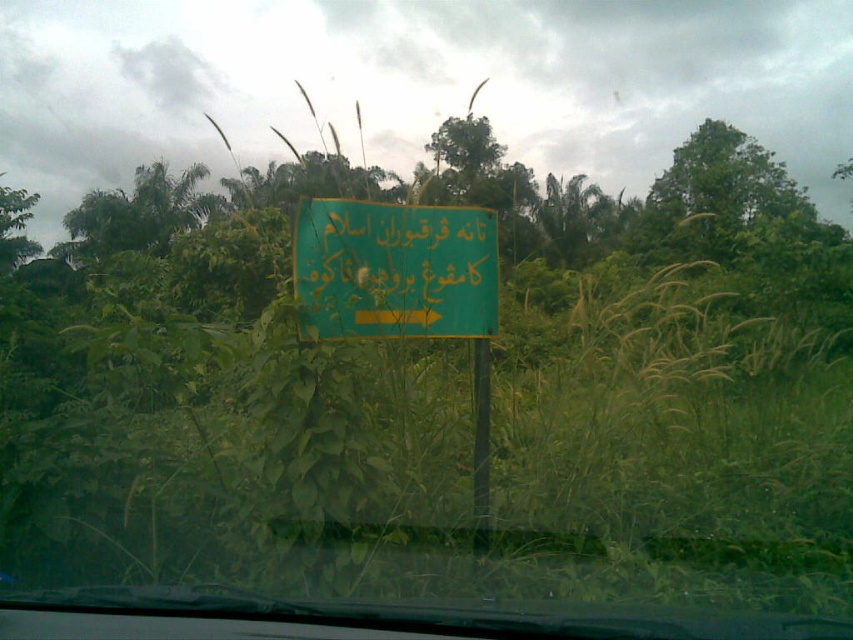
You are driving along a rural road and notice two points in the scene through your windshield. The first point is located at coordinates point (761, 218), and the second is at point (482, 346). Which of these points is closer to your car?

Point (761, 218) is closer to your car because it is further to the viewer than point (482, 346).

You are driving a car and see the green matte sign at center and the green leafy tree at upper right through your windshield. Which object appears taller in the scene?

The green leafy tree at upper right appears taller than the green matte sign at center.

In the scene shown: You are driving a car and notice the green matte sign at center and the green plastic pole at center ahead on the road. Which object is wider when viewed from your perspective inside the car?

The green matte sign at center is wider than the green plastic pole at center.